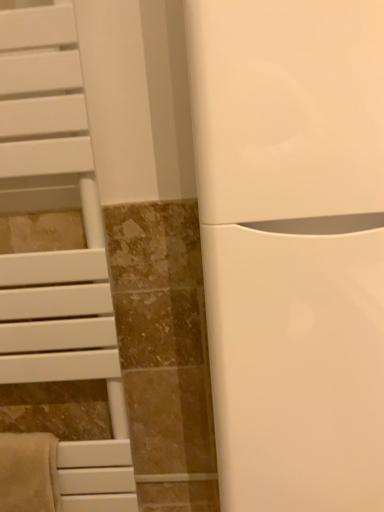
Question: Is beige soft towel at lower left spatially inside white matte towel rack at left, or outside of it?

Choices:
 (A) outside
 (B) inside

Answer: (B)

Question: In the image, is beige soft towel at lower left on the left side or the right side of white matte towel rack at left?

Choices:
 (A) left
 (B) right

Answer: (A)

Question: Based on their relative distances, which object is farther from the white matte towel rack at left?

Choices:
 (A) white glossy toilet at center
 (B) beige soft towel at lower left

Answer: (A)

Question: Which of these objects is positioned closest to the beige soft towel at lower left?

Choices:
 (A) white glossy toilet at center
 (B) white matte towel rack at left

Answer: (B)